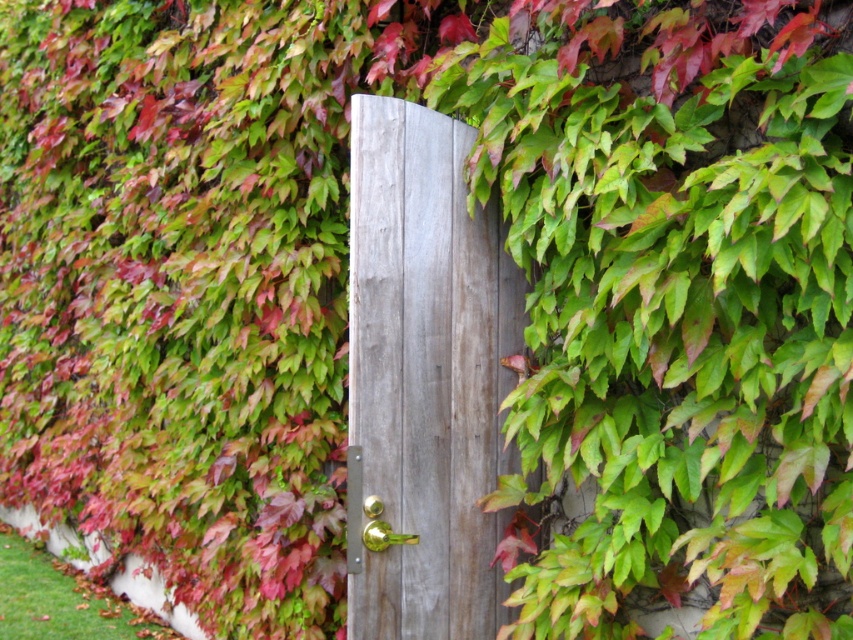
You are a painter who wants to paint the gray wood door at center and the gold metallic door handle at center. If you have a paintbrush that can cover 10 cm in width, which object will require more strokes to paint its entire width?

The gray wood door at center requires more strokes to paint its entire width because its width surpasses that of the gold metallic door handle at center, so it needs more strokes with the 10 cm paintbrush.

You are trying to open the door but the handle is stuck. You need to reach the gold metallic door handle at center. Is the gray wood door at center blocking your access to it?

The gray wood door at center is located above the gold metallic door handle at center, so the door is blocking the handle, making it inaccessible.

You are trying to open the door in the image. The gray wood door at center has a gold metallic door handle at center. Which object should you grab to open the door?

You should grab the gold metallic door handle at center to open the door since it is the handle attached to the door.